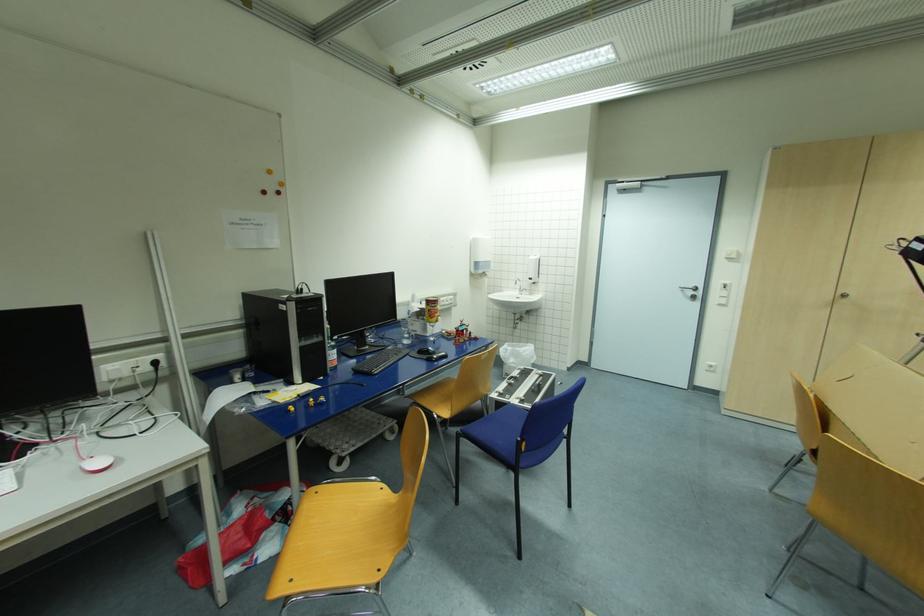
Identify the location of faucet handle. (521, 290).